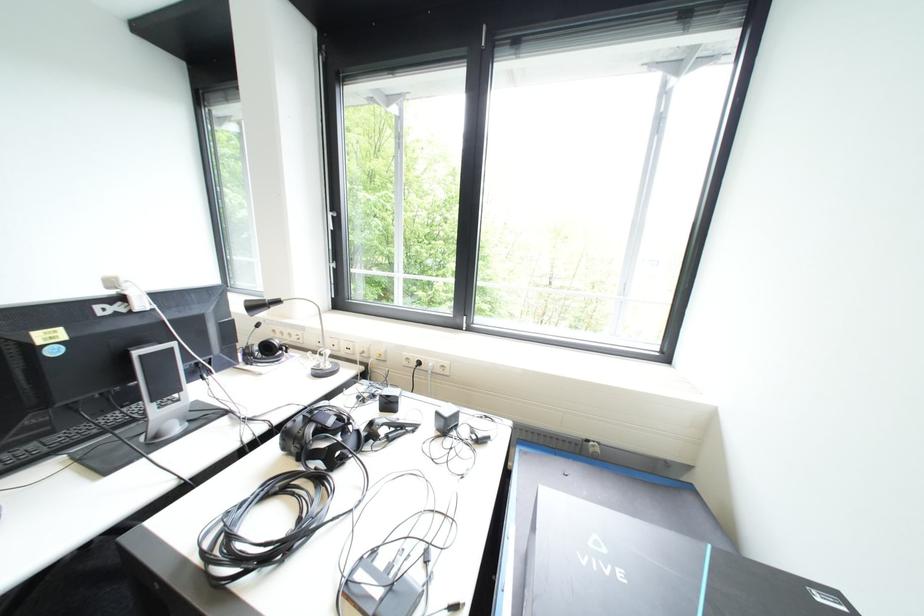
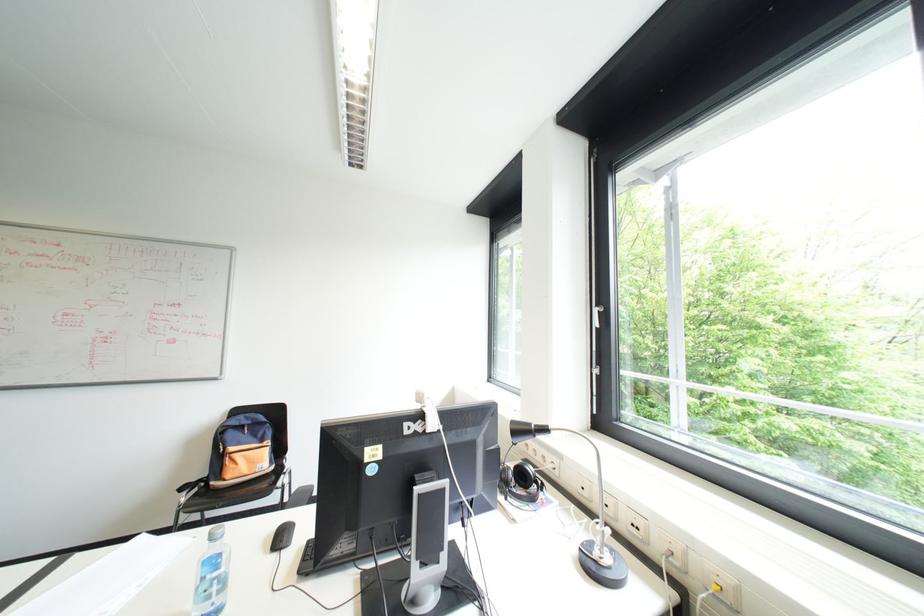
From the picture: How did the camera likely rotate?

The camera rotated toward left-up.